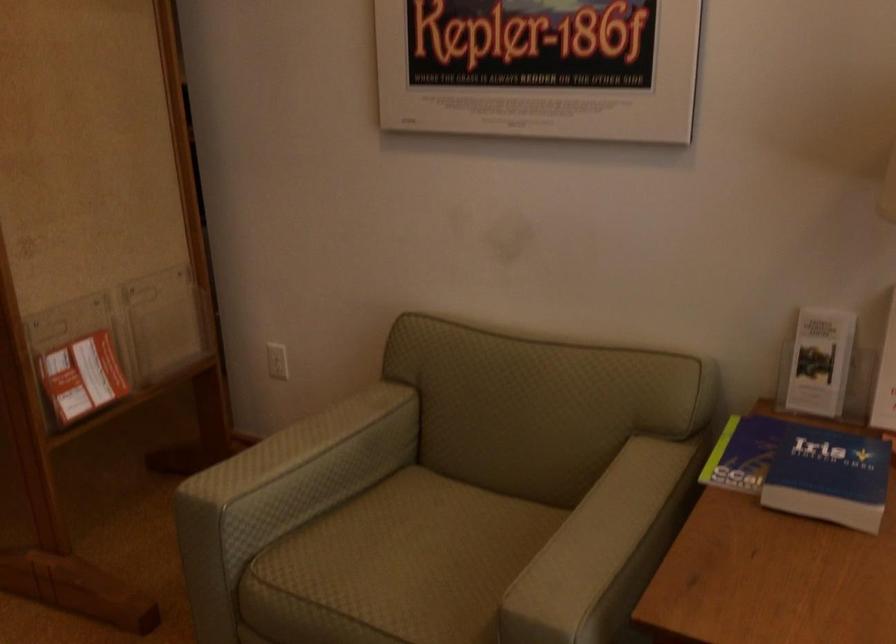
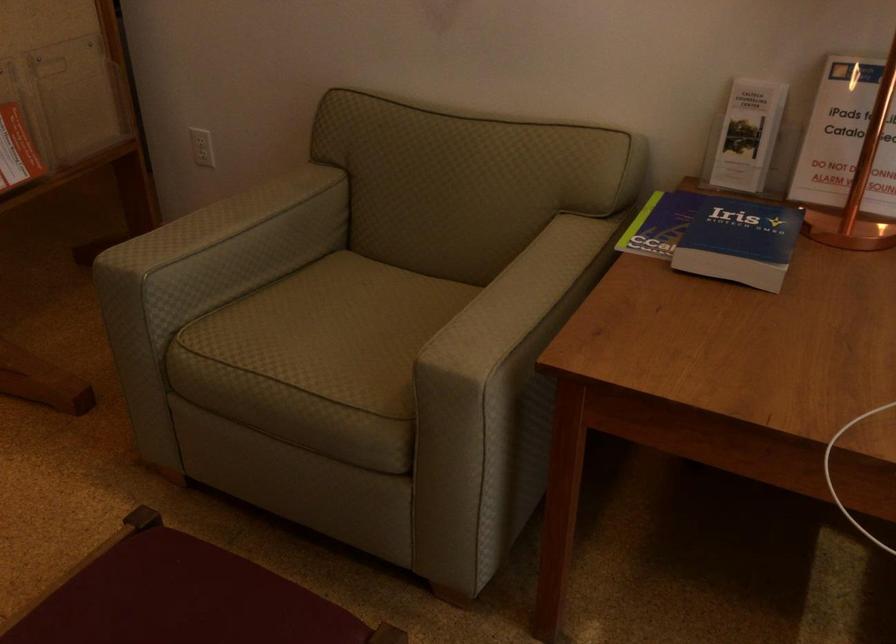
The point at [598,542] is marked in the first image. Where is the corresponding point in the second image?

(515, 299)